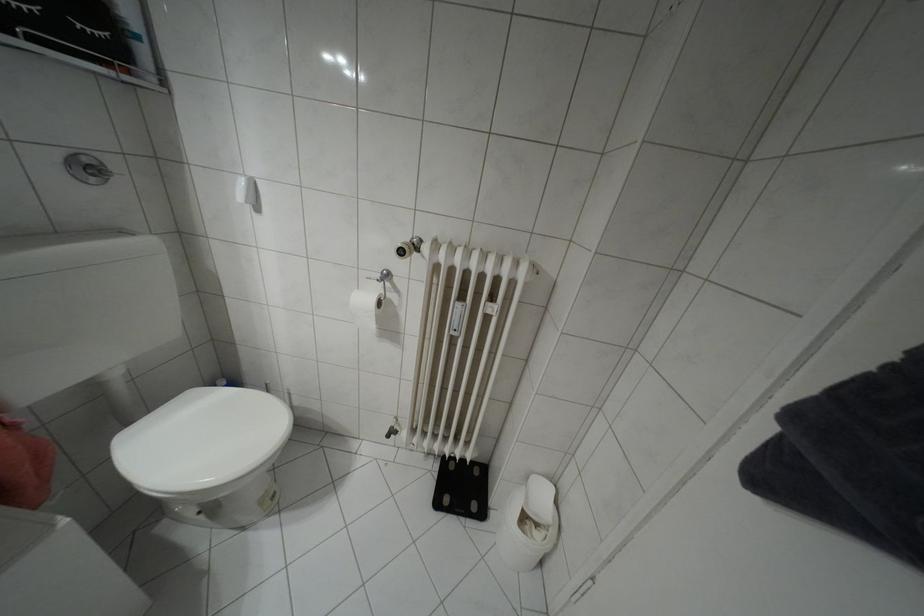
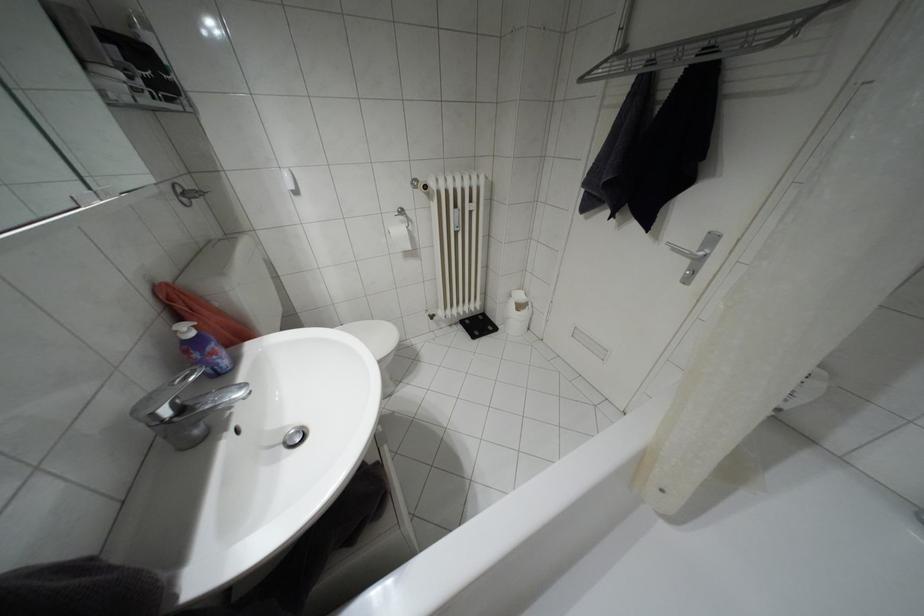
Based on the continuous images, in which direction is the camera rotating?

The camera's rotation is toward right-down.